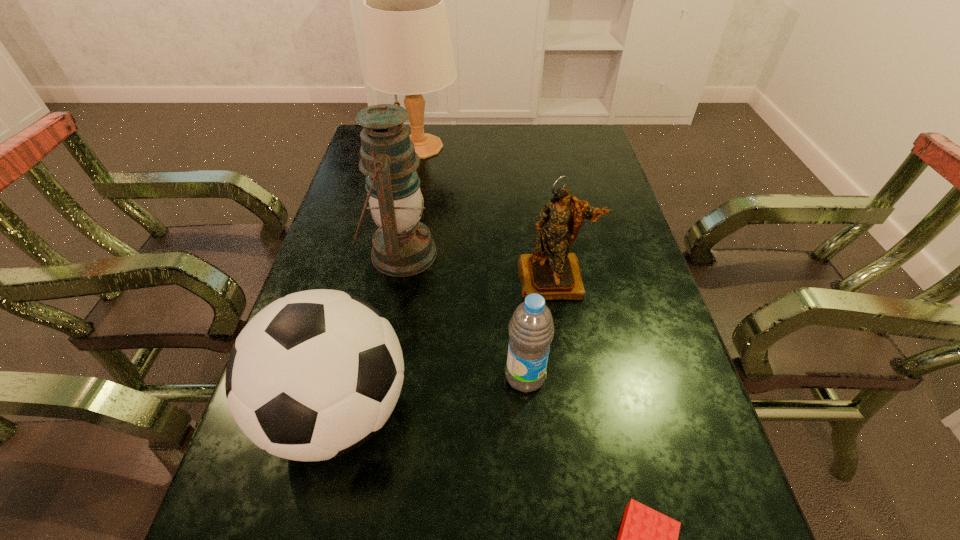
I want to click on vacant region between the fifth tallest object and the oil lamp, so click(463, 315).

Find the location of `empty space between the soccer ball and the figurine`. empty space between the soccer ball and the figurine is located at coordinates (446, 346).

This screenshot has width=960, height=540. Identify the location of unoccupied position between the water bottle and the soccer ball. (432, 394).

Locate which object is the closest to the oil lamp. Please provide its 2D coordinates. Your answer should be formatted as a tuple, i.e. [(x, y)], where the tuple contains the x and y coordinates of a point satisfying the conditions above.

[(315, 374)]

Identify the location of object that can be found as the closest to the shortest object. (531, 329).

The height and width of the screenshot is (540, 960). Identify the location of blank space that satisfies the following two spatial constraints: 1. on the back side of the soccer ball; 2. on the left side of the oil lamp. (376, 254).